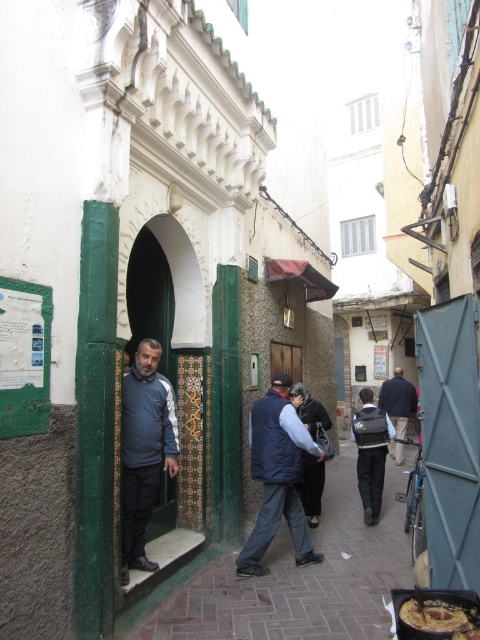
Between point (226, 550) and point (416, 611), which one is positioned in front?

Point (416, 611) is more forward.

Is brick pavement at center above shiny brown bread at center?

Incorrect, brick pavement at center is not positioned above shiny brown bread at center.

Is point (325, 540) more distant than point (409, 614)?

Yes, it is.

Where is `brick pavement at center`? brick pavement at center is located at coordinates (292, 577).

Is brick pavement at center to the right of matte blue jacket at center from the viewer's perspective?

Indeed, brick pavement at center is positioned on the right side of matte blue jacket at center.

Is point (188, 566) farther from viewer compared to point (153, 352)?

That is True.

This screenshot has width=480, height=640. What are the coordinates of `brick pavement at center` in the screenshot? It's located at (292, 577).

Who is shorter, matte blue jacket at center or blue down vest at center?

blue down vest at center is shorter.

Who is lower down, matte blue jacket at center or blue down vest at center?

Positioned lower is blue down vest at center.

Is point (177, 426) closer to viewer compared to point (292, 438)?

That is True.

Identify the location of matte blue jacket at center. (144, 451).